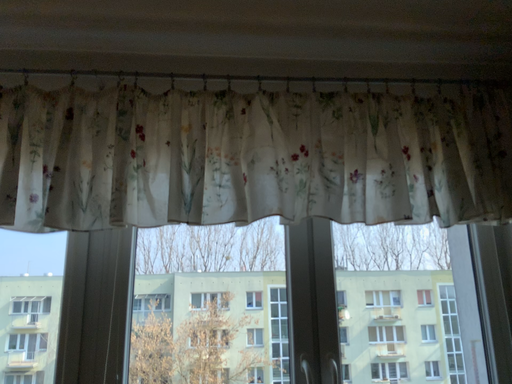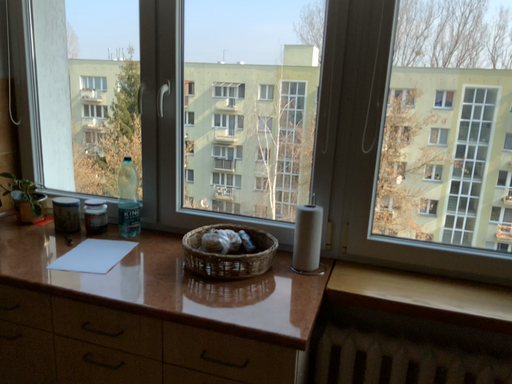
Question: How did the camera likely rotate when shooting the video?

Choices:
 (A) rotated right
 (B) rotated left

Answer: (B)